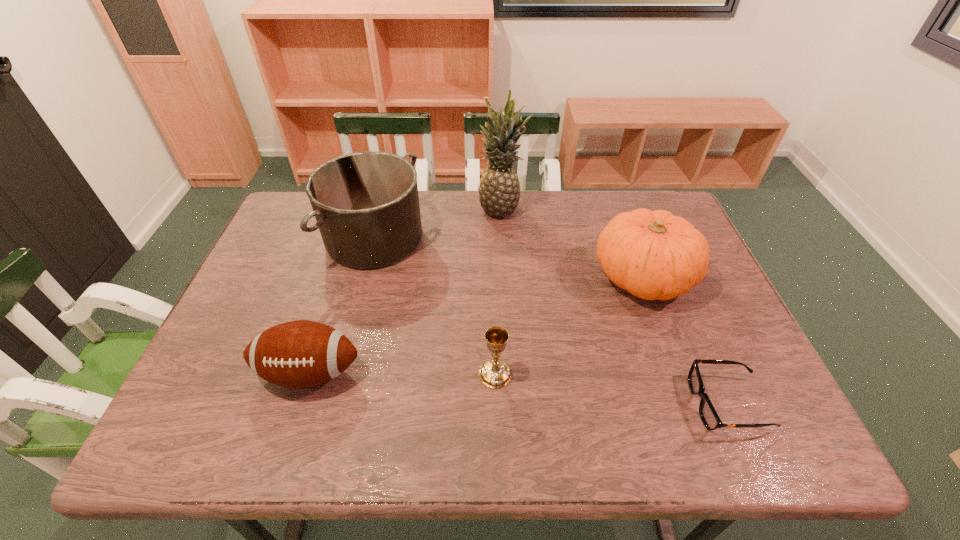
The width and height of the screenshot is (960, 540). What are the coordinates of `object at the near right corner` in the screenshot? It's located at (711, 420).

I want to click on vacant space at the far edge of the desktop, so click(469, 215).

Where is `free space at the near edge of the desktop`? free space at the near edge of the desktop is located at coordinates (662, 426).

Locate an element on the screen. free space at the left edge of the desktop is located at coordinates (202, 409).

In the image, there is a desktop. Where is `vacant space at the far right corner`? This screenshot has width=960, height=540. vacant space at the far right corner is located at coordinates (653, 201).

I want to click on vacant space that's between the football and the chalice, so click(402, 373).

The image size is (960, 540). What are the coordinates of `unoccupied position between the football and the pan` in the screenshot? It's located at (342, 305).

Where is `unoccupied area between the shortest object and the football`? unoccupied area between the shortest object and the football is located at coordinates (518, 388).

Find the location of a particular element. The width and height of the screenshot is (960, 540). vacant area that lies between the chalice and the pan is located at coordinates (435, 306).

You are a GUI agent. You are given a task and a screenshot of the screen. Output one action in this format:
    pyautogui.click(x=<x>, y=<y>)
    Task: Click on the free spot between the sunglasses and the pineapple
    
    Given the screenshot: What is the action you would take?
    pyautogui.click(x=614, y=307)